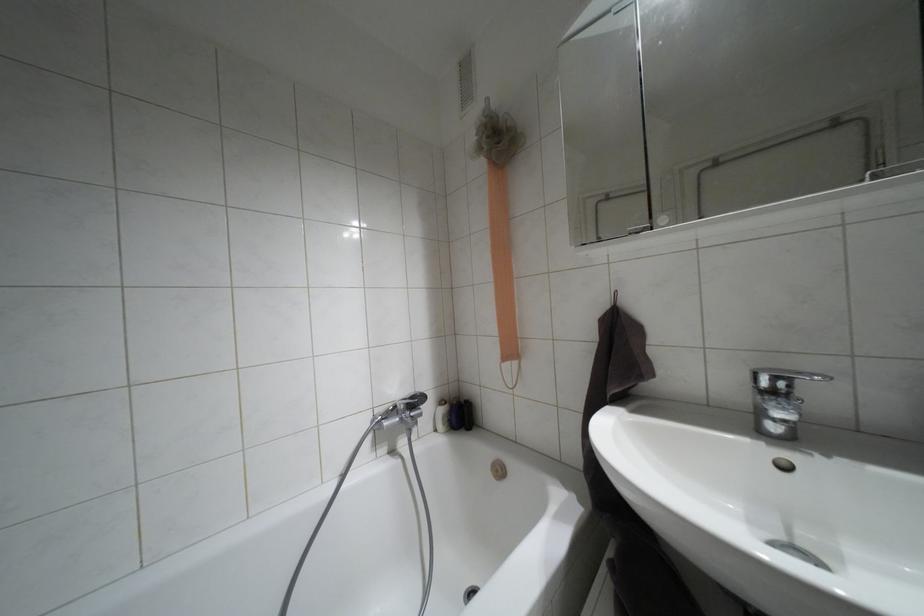
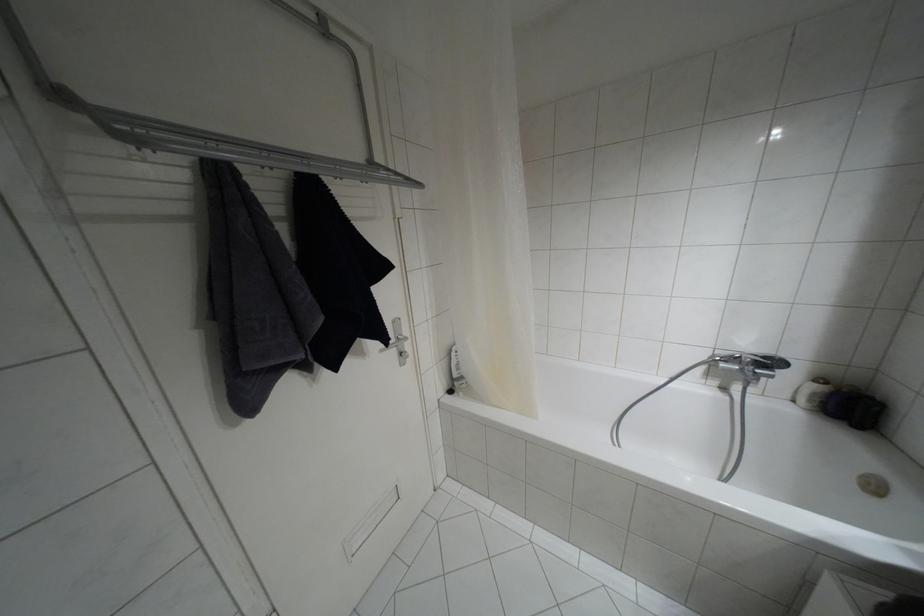
The point at (441, 400) is marked in the first image. Where is the corresponding point in the second image?

(820, 379)